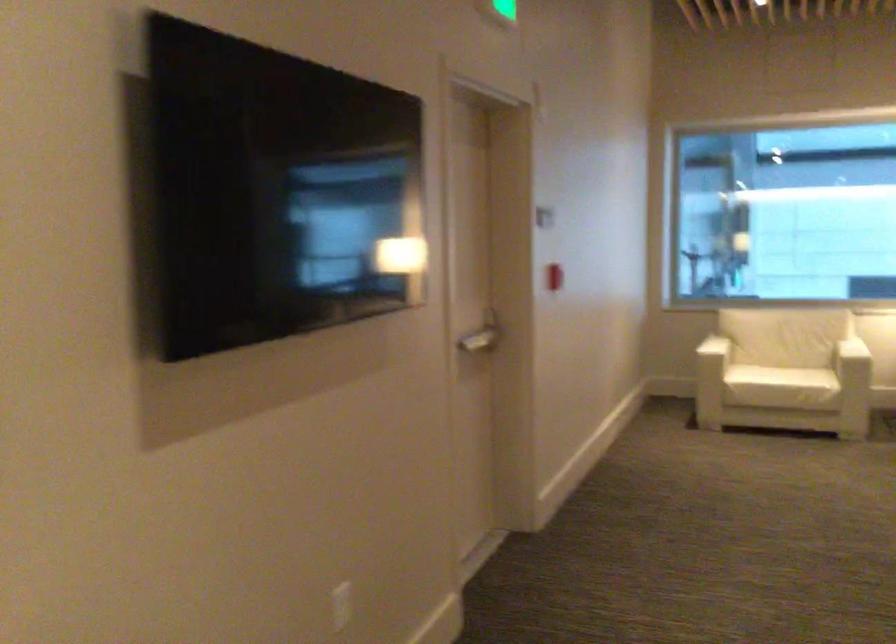
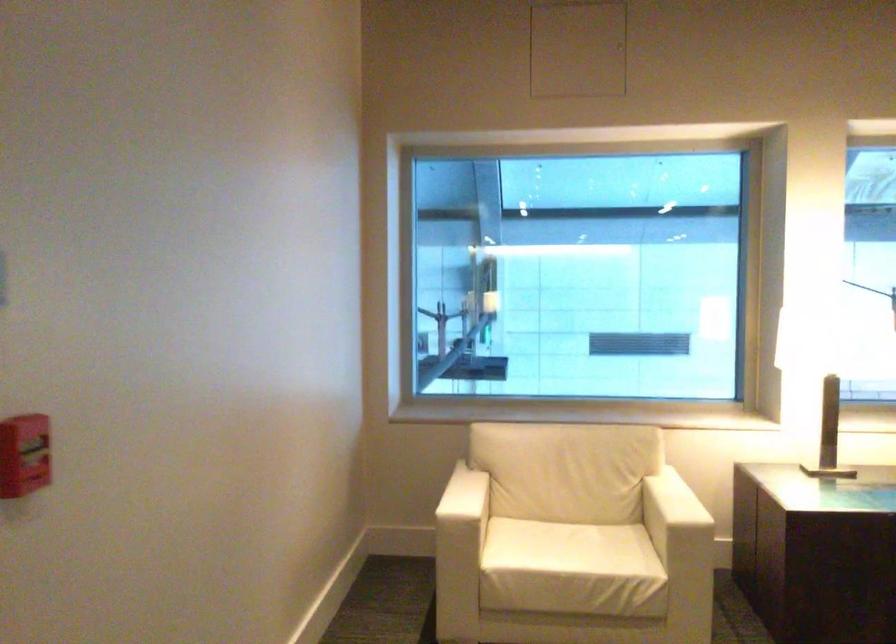
Which direction would the cameraman need to move to produce the second image?

The cameraman walked toward right, forward.